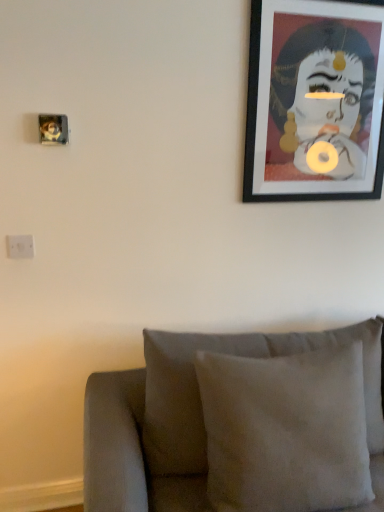
Question: Is black matte picture frame at upper right far away from white plastic electric outlet at left?

Choices:
 (A) yes
 (B) no

Answer: (A)

Question: Considering the relative sizes of black matte picture frame at upper right and white plastic electric outlet at left in the image provided, is black matte picture frame at upper right shorter than white plastic electric outlet at left?

Choices:
 (A) no
 (B) yes

Answer: (A)

Question: Could you tell me if black matte picture frame at upper right is facing white plastic electric outlet at left?

Choices:
 (A) yes
 (B) no

Answer: (B)

Question: Does black matte picture frame at upper right lie in front of white plastic electric outlet at left?

Choices:
 (A) no
 (B) yes

Answer: (B)

Question: From a real-world perspective, does black matte picture frame at upper right stand above white plastic electric outlet at left?

Choices:
 (A) yes
 (B) no

Answer: (A)

Question: Considering the positions of point (87, 486) and point (8, 234), is point (87, 486) closer or farther from the camera than point (8, 234)?

Choices:
 (A) farther
 (B) closer

Answer: (B)

Question: Would you say suede cushion at lower center is to the left or to the right of white plastic electric outlet at left in the picture?

Choices:
 (A) right
 (B) left

Answer: (A)

Question: Considering the positions of suede cushion at lower center and white plastic electric outlet at left in the image, is suede cushion at lower center taller or shorter than white plastic electric outlet at left?

Choices:
 (A) tall
 (B) short

Answer: (A)

Question: Considering the positions of suede cushion at lower center and white plastic electric outlet at left in the image, is suede cushion at lower center wider or thinner than white plastic electric outlet at left?

Choices:
 (A) wide
 (B) thin

Answer: (A)

Question: Considering the positions of black matte picture frame at upper right and suede cushion at lower center in the image, is black matte picture frame at upper right wider or thinner than suede cushion at lower center?

Choices:
 (A) thin
 (B) wide

Answer: (A)

Question: In the image, is black matte picture frame at upper right positioned in front of or behind suede cushion at lower center?

Choices:
 (A) behind
 (B) front

Answer: (A)

Question: Is black matte picture frame at upper right inside the boundaries of suede cushion at lower center, or outside?

Choices:
 (A) inside
 (B) outside

Answer: (B)

Question: In the image, is black matte picture frame at upper right on the left side or the right side of suede cushion at lower center?

Choices:
 (A) left
 (B) right

Answer: (B)

Question: Is white plastic electric outlet at left to the left or to the right of black matte picture frame at upper right in the image?

Choices:
 (A) left
 (B) right

Answer: (A)

Question: Looking at their shapes, would you say white plastic electric outlet at left is wider or thinner than black matte picture frame at upper right?

Choices:
 (A) thin
 (B) wide

Answer: (A)